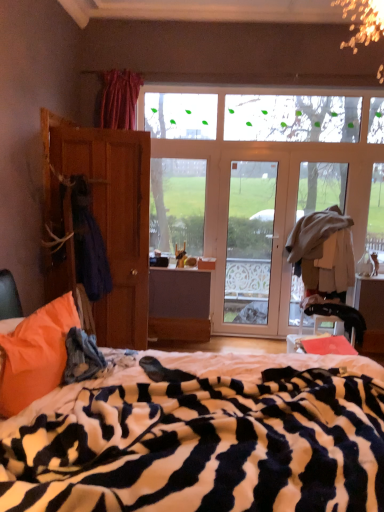
Question: Is orange soft pillow at lower left bigger or smaller than blue fuzzy blanket at lower left?

Choices:
 (A) big
 (B) small

Answer: (A)

Question: From the image's perspective, relative to blue fuzzy blanket at lower left, is orange soft pillow at lower left above or below?

Choices:
 (A) below
 (B) above

Answer: (B)

Question: Which object is the farthest from the clear glass door at center?

Choices:
 (A) black leather swivel chair at lower right
 (B) zebra-patterned blanket at center
 (C) wooden wardrobe at left
 (D) orange soft pillow at lower left
 (E) dark blue fabric at left

Answer: (D)

Question: Estimate the real-world distances between objects in this image. Which object is closer to the brown wooden screen door at left?

Choices:
 (A) clear glass door at center
 (B) wooden wardrobe at left
 (C) dark blue fabric at left
 (D) blue fuzzy blanket at lower left
 (E) zebra-patterned blanket at center

Answer: (B)